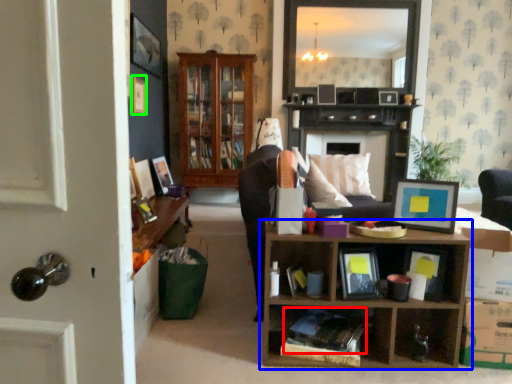
Question: Considering the real-world distances, which object is farthest from book (highlighted by a red box)? shelf (highlighted by a blue box) or picture frame (highlighted by a green box)?

Choices:
 (A) shelf
 (B) picture frame

Answer: (B)